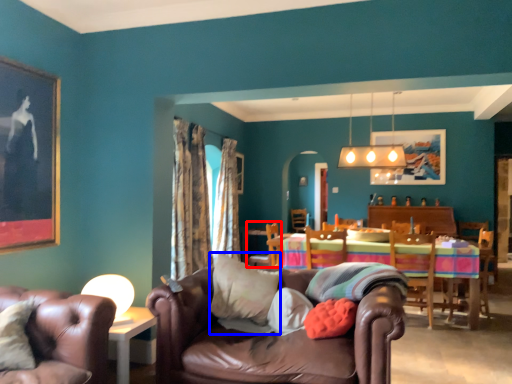
Question: Which of the following is the closest to the observer, chair (highlighted by a red box) or pillow (highlighted by a blue box)?

Choices:
 (A) chair
 (B) pillow

Answer: (B)